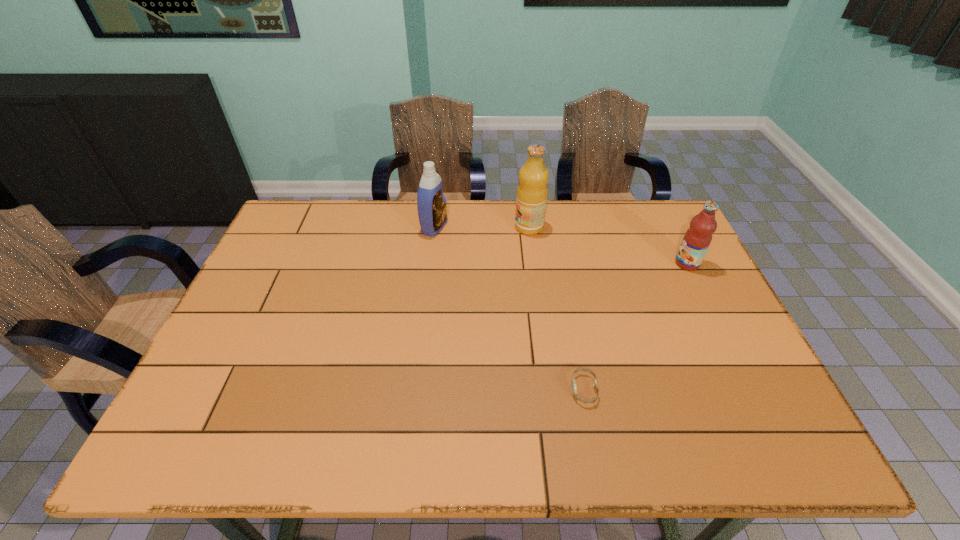
I want to click on empty space that is in between the shortest object and the detergent, so click(x=509, y=308).

Where is `free space between the taller fruit juice and the watch`? The width and height of the screenshot is (960, 540). free space between the taller fruit juice and the watch is located at coordinates (557, 308).

Locate an element on the screen. unoccupied position between the second nearest object and the nearest object is located at coordinates (636, 327).

Locate an element on the screen. Image resolution: width=960 pixels, height=540 pixels. free spot between the rightmost object and the leftmost object is located at coordinates (561, 245).

Image resolution: width=960 pixels, height=540 pixels. In order to click on vacant area between the detergent and the right fruit juice in this screenshot , I will do `click(561, 245)`.

Find the location of a particular element. object that is the nearest to the shortest object is located at coordinates (697, 239).

This screenshot has width=960, height=540. Identify the location of object that is the second closest one to the left fruit juice. (697, 239).